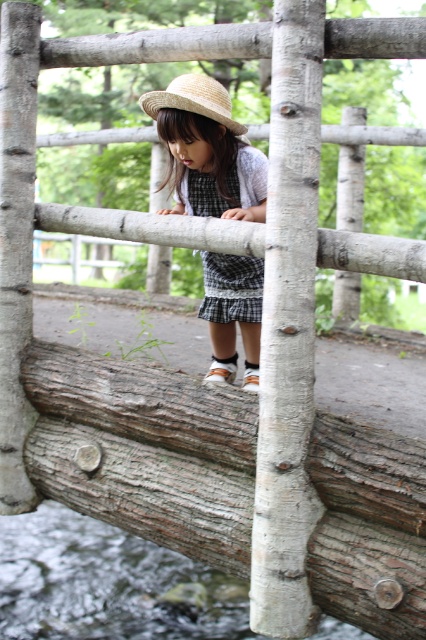
You are a photographer trying to capture the child in the center of the image. The child is wearing a checkered fabric dress at center and standing on a brown rough wood log at center. Which object should you focus on first to ensure the child is centered in your shot?

You should focus on the checkered fabric dress at center first because the brown rough wood log at center is to the left of it, so centering the dress ensures the child is properly framed.

You are a photographer trying to capture the child on the rustic wooden bridge. The child is wearing a straw hat at center. To ensure the hat is in focus, where should you position the focus point of your camera?

The straw hat at center is located at point (207, 150), so you should position the focus point at coordinates (207, 150) to ensure the hat is in focus.